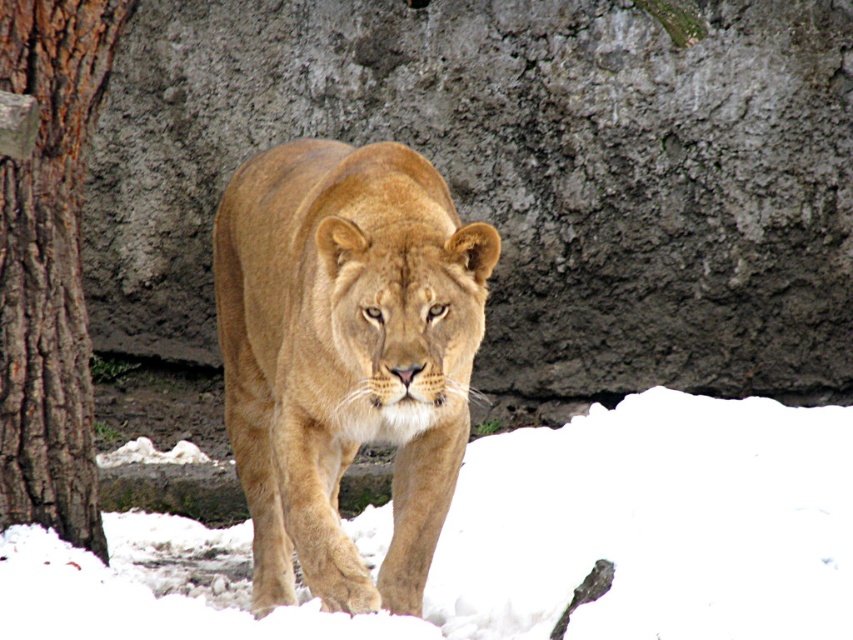
Question: Can you confirm if white fluffy snow at center is bigger than golden fur lion at center?

Choices:
 (A) yes
 (B) no

Answer: (A)

Question: Is golden fur lion at center below brown rough bark at left?

Choices:
 (A) no
 (B) yes

Answer: (B)

Question: Which point is closer to the camera taking this photo?

Choices:
 (A) (74, 218)
 (B) (242, 548)

Answer: (A)

Question: Which point appears farthest from the camera in this image?

Choices:
 (A) (389, 248)
 (B) (36, 483)

Answer: (B)

Question: Considering the real-world distances, which object is closest to the brown rough bark at left?

Choices:
 (A) golden fur lion at center
 (B) white fluffy snow at center

Answer: (A)

Question: Is white fluffy snow at center to the right of golden fur lion at center from the viewer's perspective?

Choices:
 (A) no
 (B) yes

Answer: (B)